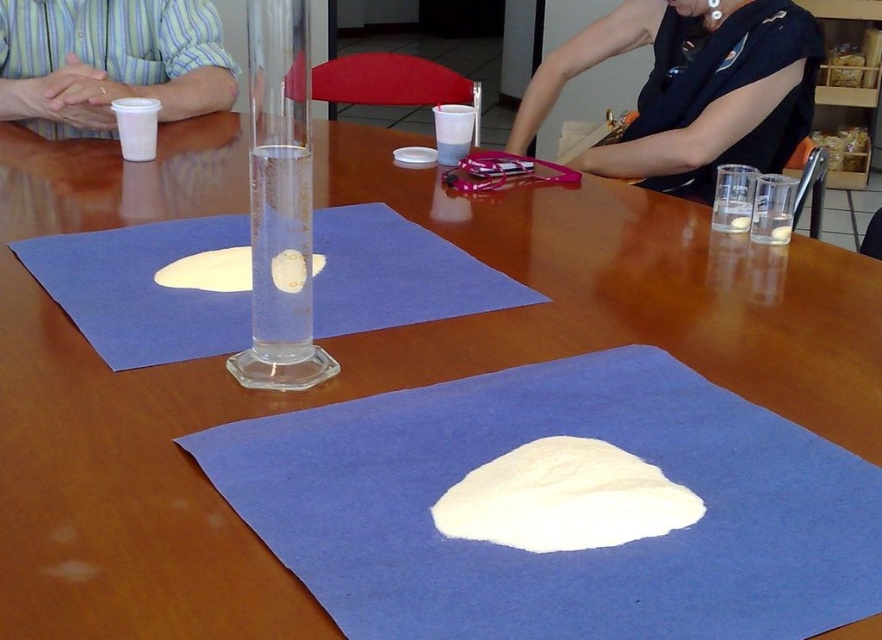
Who is shorter, white felt cloth at center or white matte dough at center?

white matte dough at center is shorter.

Does white felt cloth at center appear on the right side of white matte dough at center?

Yes, white felt cloth at center is to the right of white matte dough at center.

Is point (608, 602) less distant than point (166, 269)?

Yes.

You are a GUI agent. You are given a task and a screenshot of the screen. Output one action in this format:
    pyautogui.click(x=<x>, y=<y>)
    Task: Click on the white felt cloth at center
    The height and width of the screenshot is (640, 882).
    Given the screenshot: What is the action you would take?
    pyautogui.click(x=558, y=552)

Can you confirm if white felt cloth at center is taller than white fluffy dough at center?

Yes.

Does point (753, 452) lie behind point (633, 460)?

Yes, point (753, 452) is behind point (633, 460).

At what (x,y) coordinates should I click in order to perform the action: click on white felt cloth at center. Please return your answer as a coordinate pair (x, y). Looking at the image, I should click on (558, 552).

Does striped cotton shirt at left have a smaller size compared to white matte dough at center?

No.

Between striped cotton shirt at left and white matte dough at center, which one has less height?

Standing shorter between the two is white matte dough at center.

Locate an element on the screen. The image size is (882, 640). striped cotton shirt at left is located at coordinates (109, 61).